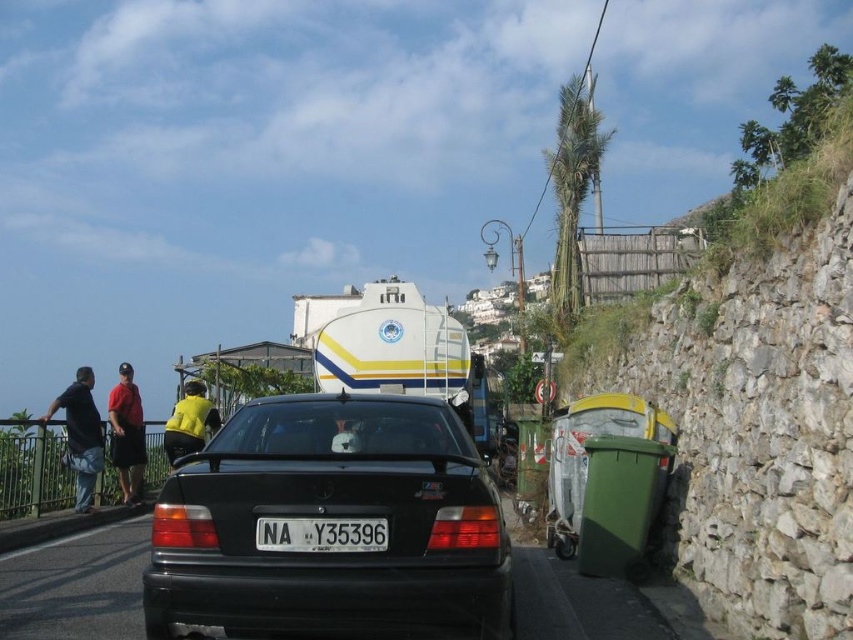
You are a delivery driver who needs to park your car in a spot that can only accommodate vehicles up to the size of the white plastic license plate at center. Can your black matte car at center fit in that parking spot?

The black matte car at center is larger in size than the white plastic license plate at center, so it cannot fit in a parking spot designed for vehicles the size of the white plastic license plate at center.

You are a pedestrian standing on the street in the image. You see a white plastic license plate at center and dark blue jeans at left. Which object is nearer to you?

The white plastic license plate at center is closer to the viewer than the dark blue jeans at left.

You are a pedestrian standing on the street and want to walk from the dark blue jeans at left to the white plastic license plate at center. Is the distance between them sufficient for you to comfortably walk without needing to detour around any obstacles?

The distance between the white plastic license plate at center and dark blue jeans at left is 8.29 meters, which is more than enough for a pedestrian to comfortably walk straight to the white plastic license plate at center without needing to detour around any obstacles.